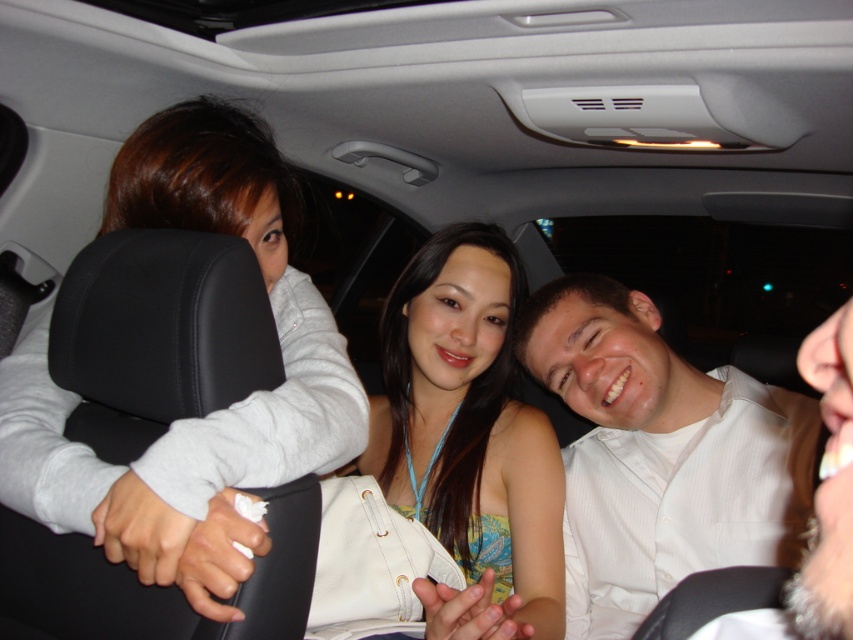
Is point (312, 454) closer to viewer compared to point (480, 269)?

Yes.

Is matte gray headrest at left thinner than matte yellow tank top at center?

Incorrect, matte gray headrest at left's width is not less than matte yellow tank top at center's.

Image resolution: width=853 pixels, height=640 pixels. What are the coordinates of `matte gray headrest at left` in the screenshot? It's located at (207, 413).

Which of these two, white textured shirt at center or matte yellow tank top at center, stands shorter?

With less height is white textured shirt at center.

Is point (738, 497) closer to camera compared to point (422, 496)?

Yes, point (738, 497) is in front of point (422, 496).

Which is in front, point (666, 577) or point (469, 305)?

Point (666, 577)

This screenshot has width=853, height=640. What are the coordinates of `white textured shirt at center` in the screenshot? It's located at (660, 454).

Does matte gray headrest at left appear under white textured shirt at center?

Incorrect, matte gray headrest at left is not positioned below white textured shirt at center.

Is matte gray headrest at left further to camera compared to white textured shirt at center?

That is False.

At what (x,y) coordinates should I click in order to perform the action: click on matte gray headrest at left. Please return your answer as a coordinate pair (x, y). This screenshot has height=640, width=853. Looking at the image, I should click on point(207,413).

At what (x,y) coordinates should I click in order to perform the action: click on matte gray headrest at left. Please return your answer as a coordinate pair (x, y). Looking at the image, I should click on (207, 413).